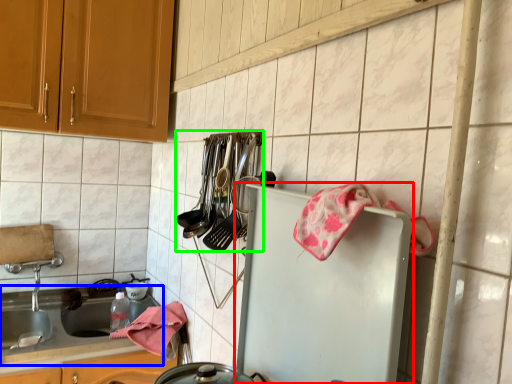
Question: Considering the real-world distances, which object is closest to refrigerator (highlighted by a red box)? countertop (highlighted by a blue box) or silverware (highlighted by a green box).

Choices:
 (A) countertop
 (B) silverware

Answer: (B)